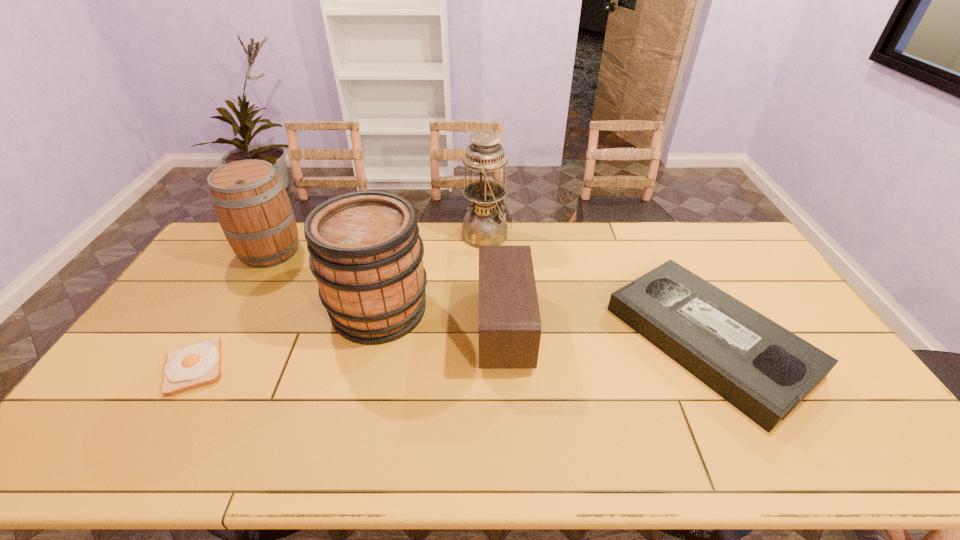
The width and height of the screenshot is (960, 540). I want to click on oil lamp, so click(x=485, y=224).

Where is `the fourth object from right to left`? This screenshot has height=540, width=960. the fourth object from right to left is located at coordinates [366, 254].

Identify the location of the nearer cider. The height and width of the screenshot is (540, 960). (366, 254).

Where is `the left cider`? Image resolution: width=960 pixels, height=540 pixels. the left cider is located at coordinates (252, 206).

The image size is (960, 540). Find the location of `the third shortest object`. the third shortest object is located at coordinates (509, 318).

The height and width of the screenshot is (540, 960). In order to click on the rightmost object in this screenshot , I will do `click(764, 370)`.

In order to click on videotape in this screenshot , I will do `click(764, 370)`.

The height and width of the screenshot is (540, 960). I want to click on the shortest object, so click(188, 367).

This screenshot has width=960, height=540. I want to click on free region located on the right of the oil lamp, so click(x=561, y=235).

You are a GUI agent. You are given a task and a screenshot of the screen. Output one action in this format:
    pyautogui.click(x=<x>, y=<y>)
    Task: Click on the vacant area situated on the right of the fourth object from right to left
    The width and height of the screenshot is (960, 540).
    Given the screenshot: What is the action you would take?
    pyautogui.click(x=510, y=310)